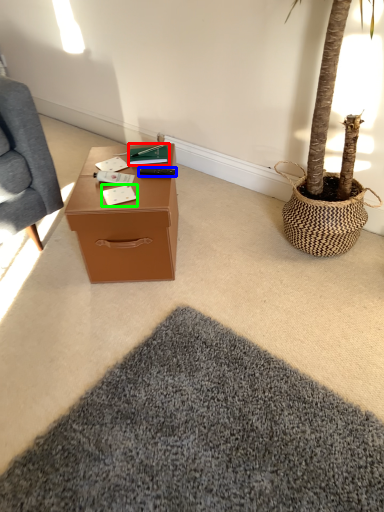
Question: Which is farther away from book (highlighted by a red box)? remote control (highlighted by a blue box) or notepad (highlighted by a green box)?

Choices:
 (A) remote control
 (B) notepad

Answer: (B)